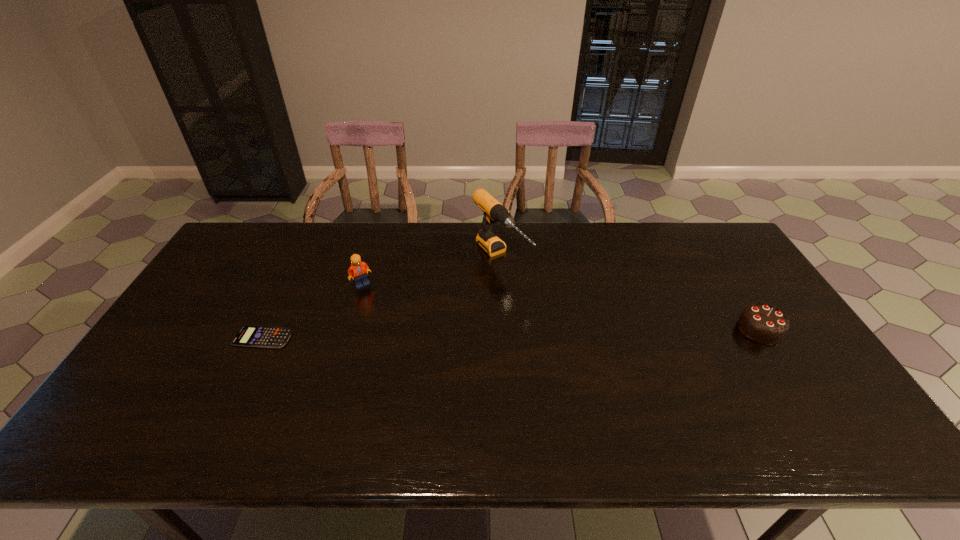
Identify the location of the leftmost object. (248, 336).

At what (x,y) coordinates should I click in order to perform the action: click on the shortest object. Please return your answer as a coordinate pair (x, y). Looking at the image, I should click on (248, 336).

Where is `the rightmost object`? Image resolution: width=960 pixels, height=540 pixels. the rightmost object is located at coordinates (762, 323).

At what (x,y) coordinates should I click in order to perform the action: click on the third tallest object. Please return your answer as a coordinate pair (x, y). The width and height of the screenshot is (960, 540). Looking at the image, I should click on point(762,323).

You are a GUI agent. You are given a task and a screenshot of the screen. Output one action in this format:
    pyautogui.click(x=<x>, y=<y>)
    Task: Click on the second object from left to right
    This screenshot has height=540, width=960.
    Given the screenshot: What is the action you would take?
    pyautogui.click(x=359, y=270)

Find the location of a particular element. This screenshot has width=960, height=540. Lego is located at coordinates (359, 270).

Image resolution: width=960 pixels, height=540 pixels. I want to click on the third object from left to right, so click(x=494, y=211).

The width and height of the screenshot is (960, 540). I want to click on drill, so click(x=494, y=211).

Find the location of `vacant space located 0.050m on the left of the calculator`. vacant space located 0.050m on the left of the calculator is located at coordinates (217, 338).

Locate an element on the screen. vacant space located 0.090m on the front of the third tallest object is located at coordinates (787, 373).